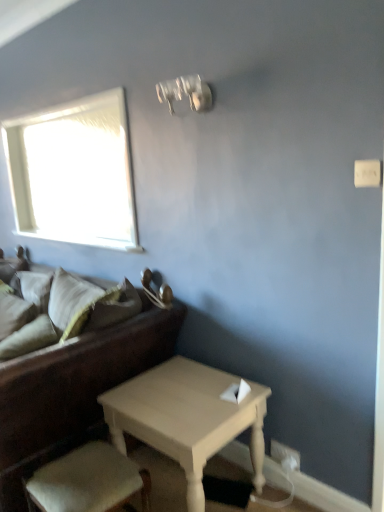
Question: Does dark brown leather couch at left have a larger size compared to light wood table at center?

Choices:
 (A) yes
 (B) no

Answer: (A)

Question: From a real-world perspective, is dark brown leather couch at left located beneath light wood table at center?

Choices:
 (A) no
 (B) yes

Answer: (A)

Question: Is dark brown leather couch at left to the left of light wood table at center from the viewer's perspective?

Choices:
 (A) yes
 (B) no

Answer: (A)

Question: Would you consider dark brown leather couch at left to be distant from light wood table at center?

Choices:
 (A) no
 (B) yes

Answer: (A)

Question: Can you confirm if dark brown leather couch at left is shorter than light wood table at center?

Choices:
 (A) no
 (B) yes

Answer: (A)

Question: Is dark brown leather couch at left facing away from light wood table at center?

Choices:
 (A) no
 (B) yes

Answer: (A)

Question: Is there a large distance between dark brown leather couch at left and soft beige pillow at left, which ranks as the 2th pillow in front-to-back order?

Choices:
 (A) yes
 (B) no

Answer: (B)

Question: Does dark brown leather couch at left come in front of soft beige pillow at left, which appears as the first pillow when viewed from the back?

Choices:
 (A) no
 (B) yes

Answer: (B)

Question: From the image's perspective, is dark brown leather couch at left located beneath soft beige pillow at left, which appears as the first pillow when viewed from the back?

Choices:
 (A) no
 (B) yes

Answer: (B)

Question: Is dark brown leather couch at left beside soft beige pillow at left, which ranks as the 2th pillow in front-to-back order?

Choices:
 (A) no
 (B) yes

Answer: (A)

Question: Is dark brown leather couch at left taller than soft beige pillow at left, which ranks as the 2th pillow in front-to-back order?

Choices:
 (A) yes
 (B) no

Answer: (A)

Question: Does dark brown leather couch at left have a larger size compared to soft beige pillow at left, which appears as the first pillow when viewed from the back?

Choices:
 (A) no
 (B) yes

Answer: (B)

Question: From the image's perspective, would you say light beige fabric armchair at lower left is positioned over soft beige pillow at left, marked as the 2th pillow in a back-to-front arrangement?

Choices:
 (A) no
 (B) yes

Answer: (A)